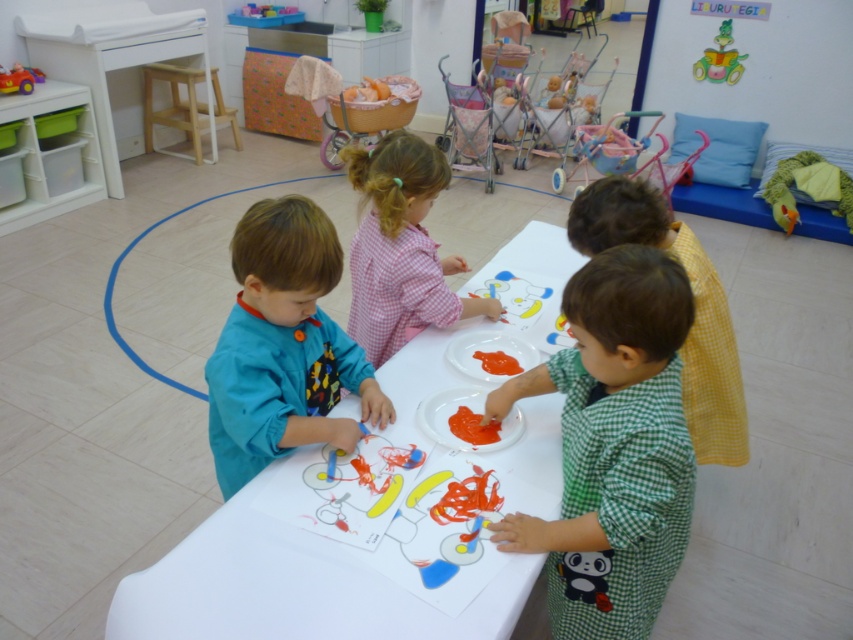
You are a teacher observing the children painting at the table. You notice the matte blue shirt at left and the rubberized plastic toy car at upper left. Which object is positioned lower in the image?

The matte blue shirt at left is positioned below the rubberized plastic toy car at upper left, so the matte blue shirt at left is lower in the image.

You are a teacher observing the children at the long white table. You notice two children wearing the green checkered shirt at center and the matte blue shirt at left. Which child is wearing a shirt with a narrower width?

The green checkered shirt at center has a lesser width compared to the matte blue shirt at left, so the child wearing the green checkered shirt at center has a narrower shirt width.